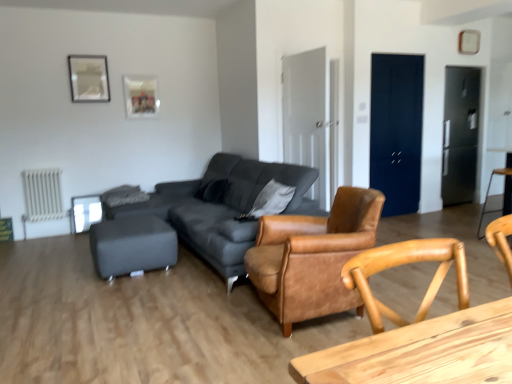
Question: Is white metallic radiator at lower left positioned in front of matte gray ottoman at lower left, the first bar stool when ordered from left to right?

Choices:
 (A) yes
 (B) no

Answer: (B)

Question: Is white metallic radiator at lower left looking in the opposite direction of matte gray ottoman at lower left, the first bar stool when ordered from left to right?

Choices:
 (A) no
 (B) yes

Answer: (A)

Question: Is the depth of white metallic radiator at lower left greater than that of matte gray ottoman at lower left, the first bar stool when ordered from left to right?

Choices:
 (A) no
 (B) yes

Answer: (B)

Question: Can you confirm if white metallic radiator at lower left is taller than matte gray ottoman at lower left, acting as the 2th bar stool starting from the right?

Choices:
 (A) no
 (B) yes

Answer: (B)

Question: Is white metallic radiator at lower left thinner than matte gray ottoman at lower left, acting as the 2th bar stool starting from the right?

Choices:
 (A) yes
 (B) no

Answer: (A)

Question: Does point (154, 225) appear closer or farther from the camera than point (92, 200)?

Choices:
 (A) closer
 (B) farther

Answer: (A)

Question: In terms of width, does matte gray ottoman at lower left, acting as the 2th bar stool starting from the right, look wider or thinner when compared to white glossy side table at left?

Choices:
 (A) wide
 (B) thin

Answer: (A)

Question: Is matte gray ottoman at lower left, acting as the 2th bar stool starting from the right, inside the boundaries of white glossy side table at left, or outside?

Choices:
 (A) inside
 (B) outside

Answer: (B)

Question: Is matte gray ottoman at lower left, the first bar stool when ordered from left to right, bigger or smaller than white glossy side table at left?

Choices:
 (A) big
 (B) small

Answer: (A)

Question: In terms of size, does wooden bar stool at right, marked as the 2th bar stool in a left-to-right arrangement, appear bigger or smaller than white glossy side table at left?

Choices:
 (A) big
 (B) small

Answer: (A)

Question: From their relative heights in the image, would you say wooden bar stool at right, marked as the 2th bar stool in a left-to-right arrangement, is taller or shorter than white glossy side table at left?

Choices:
 (A) tall
 (B) short

Answer: (A)

Question: Which is correct: wooden bar stool at right, marked as the first bar stool in a right-to-left arrangement, is inside white glossy side table at left, or outside of it?

Choices:
 (A) inside
 (B) outside

Answer: (B)

Question: Is point (510, 177) positioned closer to the camera than point (92, 220)?

Choices:
 (A) farther
 (B) closer

Answer: (B)

Question: Which is correct: metallic silver picture frame at upper left, the second picture frame in the back-to-front sequence, is inside white metallic radiator at lower left, or outside of it?

Choices:
 (A) outside
 (B) inside

Answer: (A)

Question: Is metallic silver picture frame at upper left, the 1th picture frame when ordered from left to right, wider or thinner than white metallic radiator at lower left?

Choices:
 (A) wide
 (B) thin

Answer: (B)